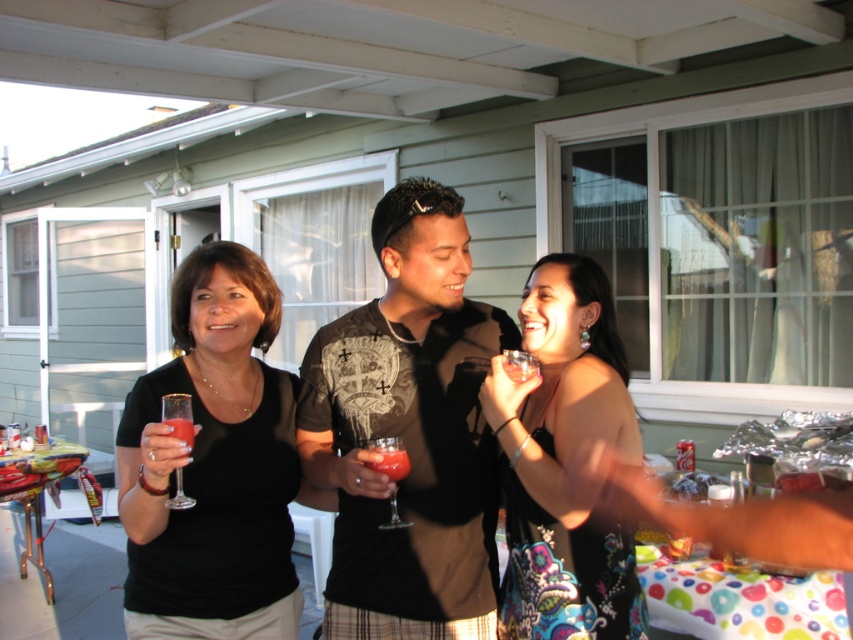
Question: Observing the image, what is the correct spatial positioning of shiny black dress at center in reference to matte glass at left?

Choices:
 (A) below
 (B) above

Answer: (A)

Question: Among these objects, which one is farthest from the camera?

Choices:
 (A) translucent glass wine glass at lower left
 (B) black matte dress at center

Answer: (A)

Question: Can you confirm if shiny black dress at center is positioned to the right of translucent glass drink at center?

Choices:
 (A) no
 (B) yes

Answer: (B)

Question: Which of the following is the farthest from the observer?

Choices:
 (A) [x=322, y=444]
 (B) [x=514, y=401]
 (C) [x=170, y=422]

Answer: (A)

Question: Observing the image, what is the correct spatial positioning of matte black shirt at center in reference to translucent glass wine glass at center?

Choices:
 (A) above
 (B) below

Answer: (A)

Question: Which object is closer to the camera taking this photo?

Choices:
 (A) shiny black dress at center
 (B) matte black shirt at center
 (C) black matte dress at center

Answer: (C)